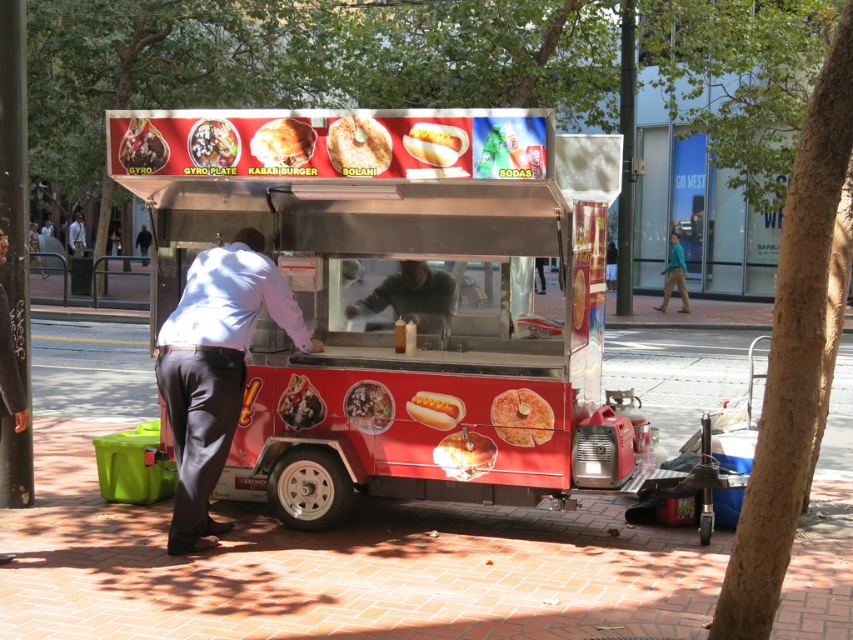
How distant is golden crispy chicken at center from smooth plastic hot dog at center?

They are 45.90 centimeters apart.

Can you confirm if golden crispy chicken at center is wider than smooth plastic hot dog at center?

Yes.

Identify the location of golden crispy chicken at center. 463,454.

Is golden crispy hot dog at center above white shirt at center?

Incorrect, golden crispy hot dog at center is not positioned above white shirt at center.

In the scene shown: Is golden crispy hot dog at center below white shirt at center?

Indeed, golden crispy hot dog at center is positioned under white shirt at center.

At what (x,y) coordinates should I click in order to perform the action: click on golden crispy hot dog at center. Please return your answer as a coordinate pair (x, y). The width and height of the screenshot is (853, 640). Looking at the image, I should click on (434, 144).

Does golden crispy chicken at center have a larger size compared to smooth white hot dog at center?

Yes, golden crispy chicken at center is bigger than smooth white hot dog at center.

Does point (483, 456) come closer to viewer compared to point (444, 396)?

Yes, it is.

Where is `golden crispy chicken at center`? The image size is (853, 640). golden crispy chicken at center is located at coordinates (463, 454).